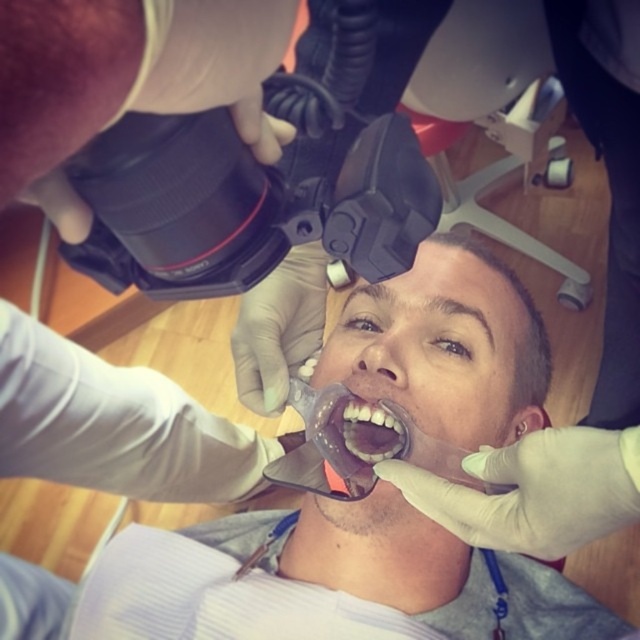
Question: Which object appears farthest from the camera in this image?

Choices:
 (A) clear plastic mouthguard at center
 (B) translucent plastic mouthpiece at center

Answer: (B)

Question: From the image, what is the correct spatial relationship of clear plastic mouthguard at center in relation to translucent plastic mouthpiece at center?

Choices:
 (A) above
 (B) below

Answer: (B)

Question: Is clear plastic mouthguard at center further to the viewer compared to translucent plastic mouthpiece at center?

Choices:
 (A) yes
 (B) no

Answer: (B)

Question: Is clear plastic mouthguard at center below translucent plastic mouthpiece at center?

Choices:
 (A) yes
 (B) no

Answer: (A)

Question: Which of the following is the farthest from the observer?

Choices:
 (A) (356, 410)
 (B) (97, 461)

Answer: (B)